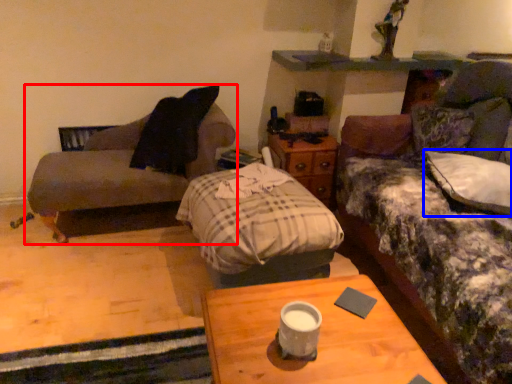
Question: Among these objects, which one is farthest to the camera, studio couch (highlighted by a red box) or pillow (highlighted by a blue box)?

Choices:
 (A) studio couch
 (B) pillow

Answer: (A)